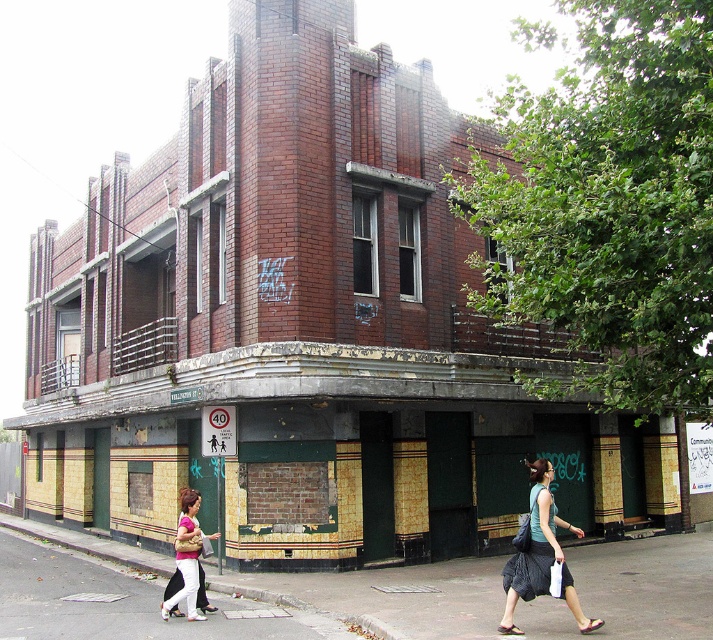
Is smooth concrete sidewalk at lower center positioned in front of green fabric bag at lower right?

No, smooth concrete sidewalk at lower center is behind green fabric bag at lower right.

Which is behind, point (34, 577) or point (503, 616)?

The point (34, 577) is more distant.

Which is in front, point (183, 620) or point (503, 612)?

Positioned in front is point (503, 612).

Find the location of a particular element. This screenshot has width=713, height=640. smooth concrete sidewalk at lower center is located at coordinates (123, 602).

Which is below, yellow tiled storefront at center or matte pink shirt at lower center?

yellow tiled storefront at center is lower down.

Does yellow tiled storefront at center have a greater width compared to matte pink shirt at lower center?

Yes.

Between point (133, 380) and point (190, 561), which one is positioned behind?

Point (133, 380)

Locate an element on the screen. yellow tiled storefront at center is located at coordinates (338, 452).

Is green fabric bag at lower right taller than matte pink shirt at lower center?

Yes.

Is green fabric bag at lower right to the left of matte pink shirt at lower center from the viewer's perspective?

Incorrect, green fabric bag at lower right is not on the left side of matte pink shirt at lower center.

Between point (540, 534) and point (183, 573), which one is positioned behind?

The point (183, 573) is more distant.

The height and width of the screenshot is (640, 713). Find the location of `green fabric bag at lower right`. green fabric bag at lower right is located at coordinates (540, 556).